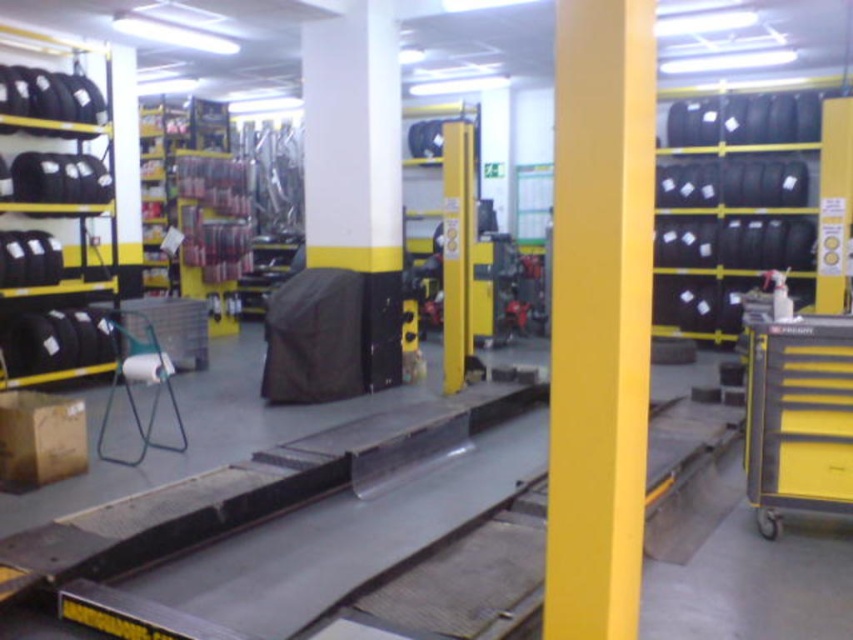
You are a customer entering the tire shop and need to locate the black rubber tires at left. From your perspective, which side of the black matte pillar at center should you look towards to find them?

The black rubber tires at left are located to the left of the black matte pillar at center, so you should look towards the left side of the black matte pillar at center to find them.